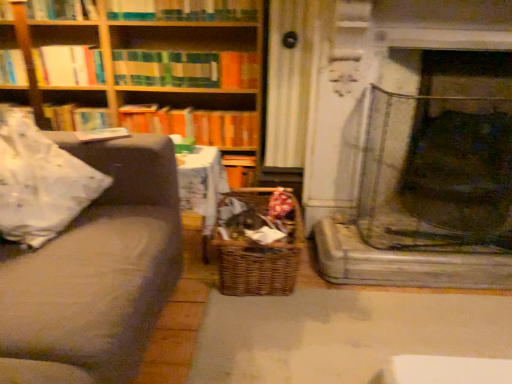
Question: Which direction should I rotate to look at orange matte book at center, acting as the 1th book starting from the bottom, — up or down?

Choices:
 (A) up
 (B) down

Answer: (A)

Question: Does white fabric pillow at left come behind woodenmaterial/texturebookcase at upper left?

Choices:
 (A) yes
 (B) no

Answer: (B)

Question: From a real-world perspective, is white fabric pillow at left on top of woodenmaterial/texturebookcase at upper left?

Choices:
 (A) no
 (B) yes

Answer: (A)

Question: Is white fabric pillow at left at the right side of woodenmaterial/texturebookcase at upper left?

Choices:
 (A) yes
 (B) no

Answer: (A)

Question: Considering the relative sizes of white fabric pillow at left and woodenmaterial/texturebookcase at upper left in the image provided, is white fabric pillow at left taller than woodenmaterial/texturebookcase at upper left?

Choices:
 (A) yes
 (B) no

Answer: (B)

Question: Is white fabric pillow at left not within woodenmaterial/texturebookcase at upper left?

Choices:
 (A) yes
 (B) no

Answer: (A)

Question: Considering the relative sizes of white fabric pillow at left and woodenmaterial/texturebookcase at upper left in the image provided, is white fabric pillow at left wider than woodenmaterial/texturebookcase at upper left?

Choices:
 (A) no
 (B) yes

Answer: (B)

Question: From the image's perspective, does striped fabric book at upper center, the third book when ordered from top to bottom, appear lower than wooden bookshelf at upper left?

Choices:
 (A) yes
 (B) no

Answer: (A)

Question: Does striped fabric book at upper center, the third book when ordered from top to bottom, have a lesser height compared to wooden bookshelf at upper left?

Choices:
 (A) no
 (B) yes

Answer: (B)

Question: From a real-world perspective, is striped fabric book at upper center, the third book when ordered from top to bottom, physically above wooden bookshelf at upper left?

Choices:
 (A) yes
 (B) no

Answer: (B)

Question: Is striped fabric book at upper center, the third book when ordered from top to bottom, positioned with its back to wooden bookshelf at upper left?

Choices:
 (A) yes
 (B) no

Answer: (B)

Question: Can you confirm if striped fabric book at upper center, arranged as the 3th book when ordered from the bottom, is smaller than wooden bookshelf at upper left?

Choices:
 (A) no
 (B) yes

Answer: (B)

Question: Is the position of striped fabric book at upper center, the third book when ordered from top to bottom, more distant than that of wooden bookshelf at upper left?

Choices:
 (A) yes
 (B) no

Answer: (B)

Question: Does hardcover book at upper left, positioned as the fourth book in top-to-bottom order, appear on the left side of woodenmaterial/texturebookcase at upper left?

Choices:
 (A) no
 (B) yes

Answer: (B)